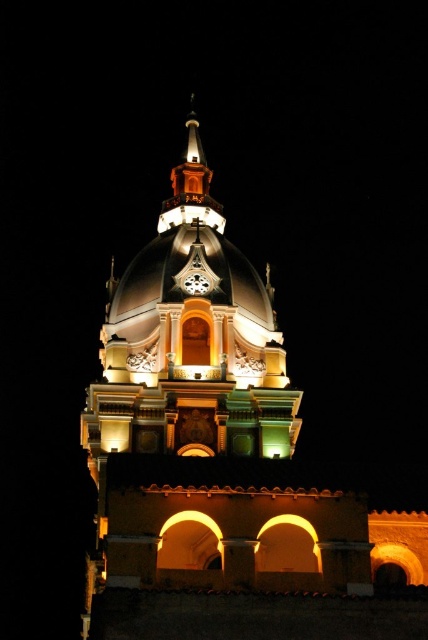
You are a photographer aiming to capture the church tower. You notice the polished gold dome at center and the polished brass spire at upper center. Which object should you focus on if you want to photograph the taller structure?

The polished gold dome at center is taller than the polished brass spire at upper center, so you should focus on the polished gold dome at center.

You are standing at the base of the church tower and want to know the distance between the polished brass spire at upper center and the white glossy clock at center. How far apart are they?

The polished brass spire at upper center is 15.75 meters from the white glossy clock at center.

You are standing in front of the church tower and want to take a photo of both the polished gold dome at center and the white glossy clock at center. Which object should you adjust your camera to focus on first if you want to capture both in the frame?

The polished gold dome at center is to the left of white glossy clock at center, so you should focus on the white glossy clock at center first as it is on the right side to ensure both are in frame.